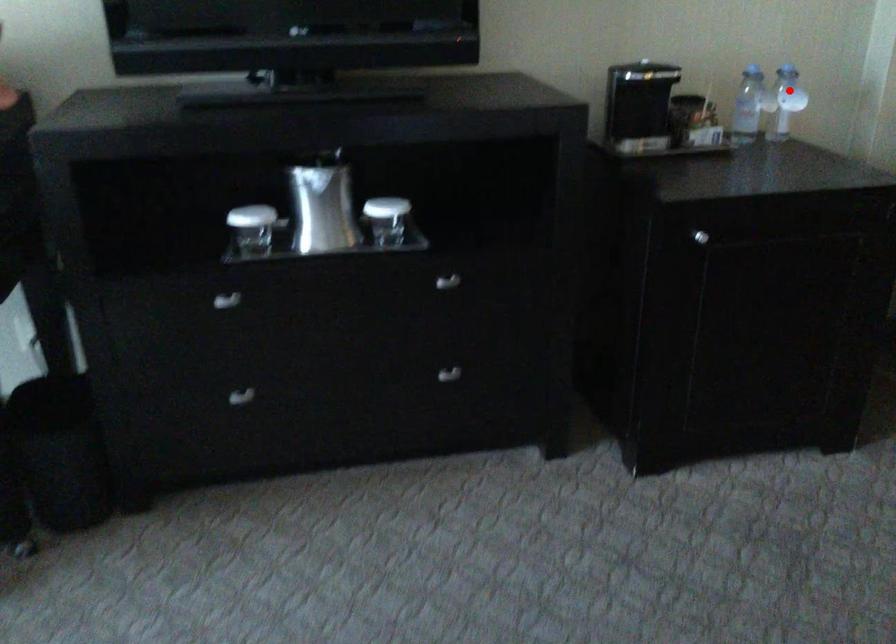
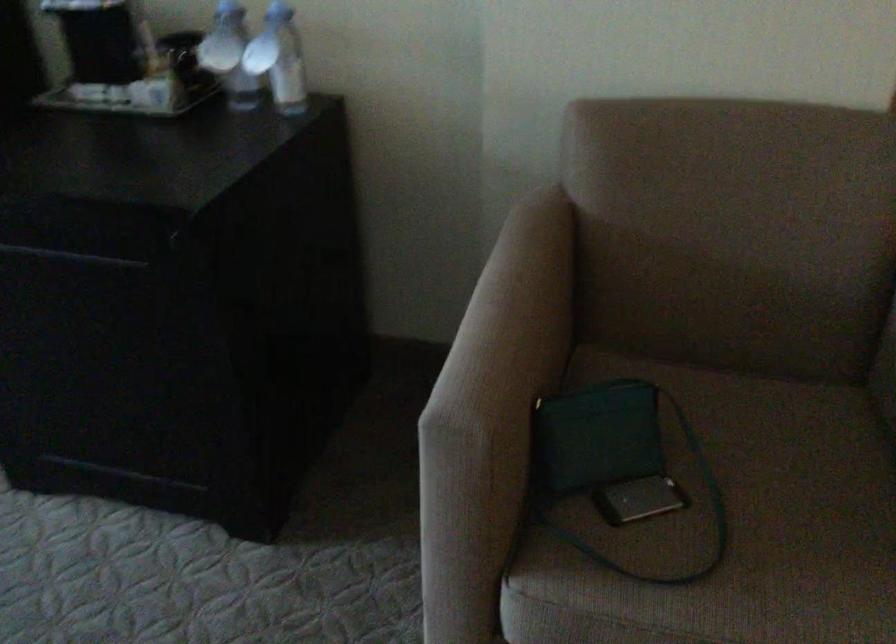
Locate, in the second image, the point that corresponds to the highlighted location in the first image.

(279, 59)